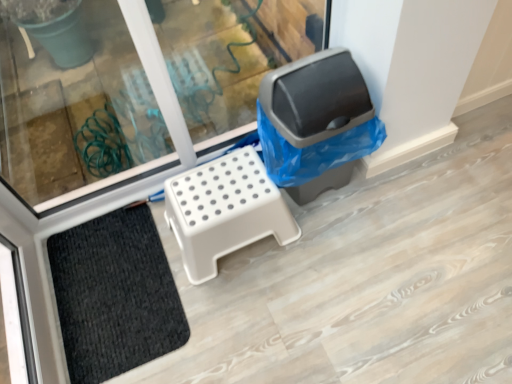
Locate an element on the screen. free space in front of gray plastic recycling bin at right is located at coordinates (333, 250).